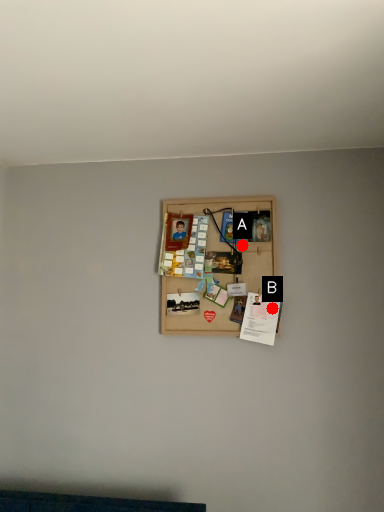
Question: Two points are circled on the image, labeled by A and B beside each circle. Which point is closer to the camera taking this photo?

Choices:
 (A) A is closer
 (B) B is closer

Answer: (B)